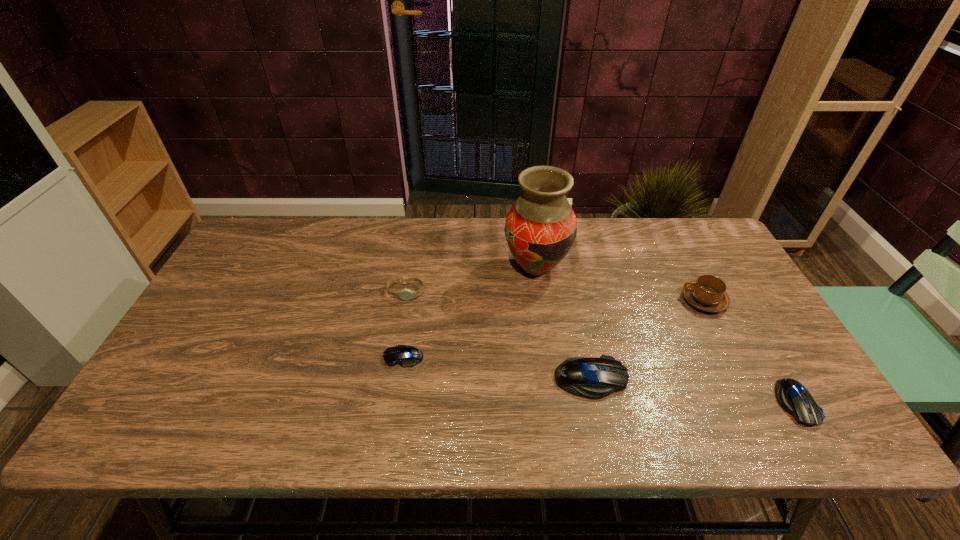
Find the location of a particular element. This screenshot has width=960, height=540. object that is at the near right corner is located at coordinates (792, 396).

Identify the location of vacant region at the far edge. Image resolution: width=960 pixels, height=540 pixels. (351, 236).

You are a GUI agent. You are given a task and a screenshot of the screen. Output one action in this format:
    pyautogui.click(x=<x>, y=<y>)
    Task: Click on the free region at the near edge of the desktop
    Image resolution: width=960 pixels, height=540 pixels.
    Given the screenshot: What is the action you would take?
    pyautogui.click(x=540, y=375)

The width and height of the screenshot is (960, 540). In the image, there is a desktop. In order to click on free space at the left edge in this screenshot , I will do `click(210, 364)`.

Identify the location of vacant area at the right edge of the desktop. (698, 269).

In order to click on blank area at the far left corner in this screenshot , I will do `click(264, 240)`.

Locate an element on the screen. vacant area at the near right corner is located at coordinates (763, 404).

Where is `vacant space that's between the fifth tallest object and the second computer mouse from right to left`? The image size is (960, 540). vacant space that's between the fifth tallest object and the second computer mouse from right to left is located at coordinates (693, 391).

The height and width of the screenshot is (540, 960). Find the location of `empty space that is in between the rightmost computer mouse and the cappuccino`. empty space that is in between the rightmost computer mouse and the cappuccino is located at coordinates (750, 352).

Locate an element on the screen. free spot between the shortest object and the tallest object is located at coordinates (469, 313).